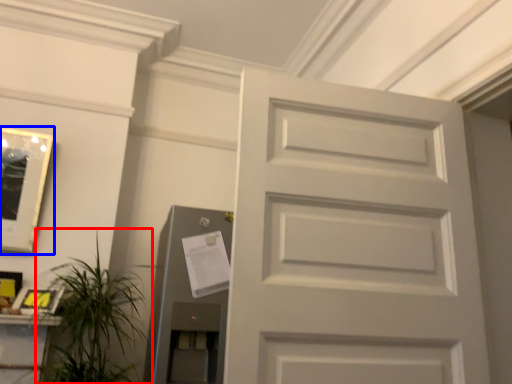
Question: Which of the following is the farthest to the observer, houseplant (highlighted by a red box) or picture frame (highlighted by a blue box)?

Choices:
 (A) houseplant
 (B) picture frame

Answer: (B)